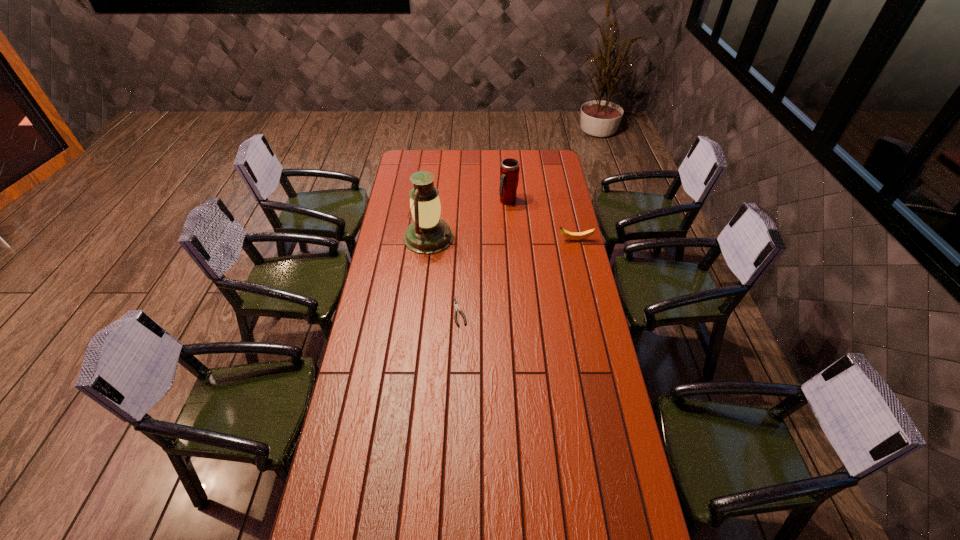
In the image, there is a desktop. At what (x,y) coordinates should I click in order to perform the action: click on vacant area at the far edge. Please return your answer as a coordinate pair (x, y). Image resolution: width=960 pixels, height=540 pixels. Looking at the image, I should click on (442, 169).

Where is `vacant space at the near edge of the desktop`? vacant space at the near edge of the desktop is located at coordinates (482, 528).

Locate an element on the screen. The width and height of the screenshot is (960, 540). vacant space at the left edge is located at coordinates (332, 483).

Locate an element on the screen. The height and width of the screenshot is (540, 960). vacant space at the right edge is located at coordinates (601, 342).

What are the coordinates of `vacant space at the far right corner` in the screenshot? It's located at (551, 159).

Locate an element on the screen. This screenshot has width=960, height=540. empty space that is in between the banana and the thermos bottle is located at coordinates (541, 221).

This screenshot has width=960, height=540. I want to click on empty space between the second object from right to left and the nearest object, so point(484,256).

Find the location of a particular element. The height and width of the screenshot is (540, 960). free space between the rightmost object and the leftmost object is located at coordinates (502, 239).

In order to click on vacant space that's between the leftmost object and the second shortest object in this screenshot , I will do `click(502, 239)`.

Where is `free area in between the pliers and the banana`? The width and height of the screenshot is (960, 540). free area in between the pliers and the banana is located at coordinates (517, 276).